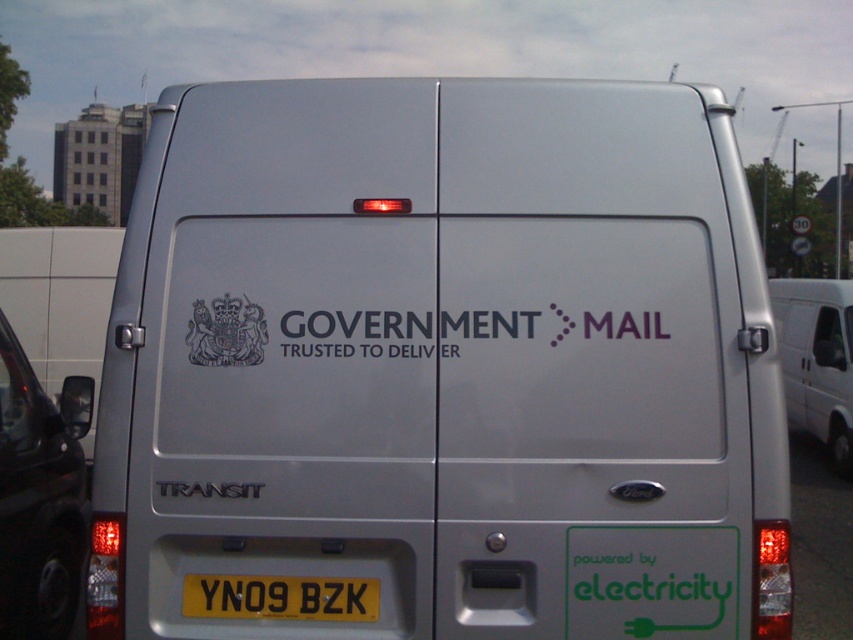
Which of these two, yellow metallic license plate at center or white matte government mail logo at center, stands taller?

Standing taller between the two is yellow metallic license plate at center.

Measure the distance between point (189,582) and camera.

The distance of point (189,582) from camera is 10.55 feet.

At what (x,y) coordinates should I click in order to perform the action: click on yellow metallic license plate at center. Please return your answer as a coordinate pair (x, y). Looking at the image, I should click on (280, 596).

Who is positioned more to the left, silver metallic van at center or yellow metallic license plate at center?

silver metallic van at center is more to the left.

Measure the distance between silver metallic van at center and camera.

The distance of silver metallic van at center from camera is 3.07 meters.

Describe the element at coordinates (444, 364) in the screenshot. This screenshot has width=853, height=640. I see `silver metallic van at center` at that location.

Find the location of a particular element. Image resolution: width=853 pixels, height=640 pixels. silver metallic van at center is located at coordinates (444, 364).

Can you confirm if black glossy car at left is wider than yellow metallic license plate at center?

Correct, the width of black glossy car at left exceeds that of yellow metallic license plate at center.

Can you confirm if black glossy car at left is thinner than yellow metallic license plate at center?

No, black glossy car at left is not thinner than yellow metallic license plate at center.

Is point (65, 516) closer to camera compared to point (350, 616)?

No.

In order to click on black glossy car at left in this screenshot , I will do `click(39, 497)`.